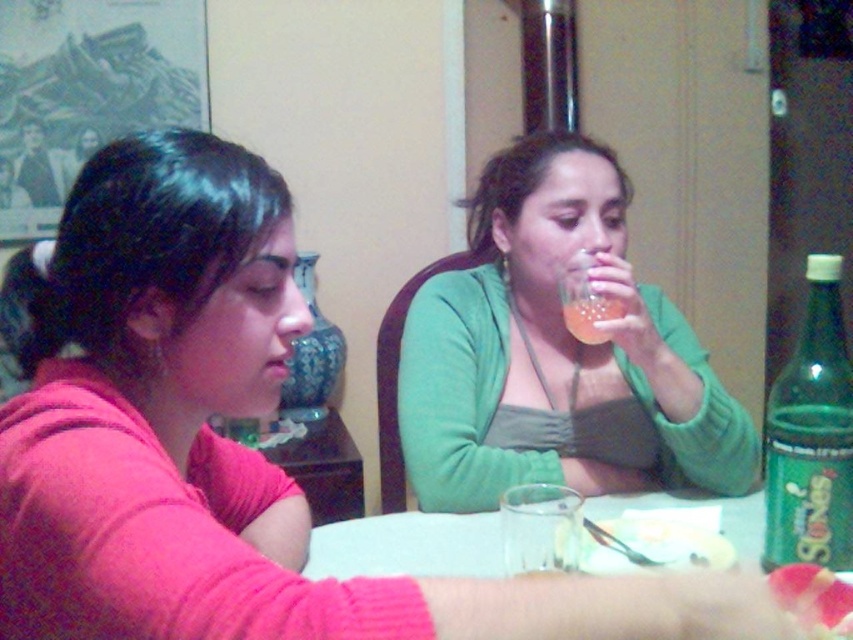
Question: Among these objects, which one is farthest from the camera?

Choices:
 (A) translucent plastic cup at upper center
 (B) green glass bottle at right

Answer: (A)

Question: Among these objects, which one is farthest from the camera?

Choices:
 (A) green glass bottle at right
 (B) pink glossy flower at upper center
 (C) white plastic table at lower center
 (D) green textured sweater at upper right

Answer: (D)

Question: Which is farther from the pink glossy flower at upper center?

Choices:
 (A) white plastic table at lower center
 (B) green glass bottle at right

Answer: (A)

Question: Can you confirm if green textured sweater at upper right is thinner than green glass bottle at right?

Choices:
 (A) no
 (B) yes

Answer: (A)

Question: In this image, where is white plastic table at lower center located relative to translucent plastic cup at upper center?

Choices:
 (A) below
 (B) above

Answer: (A)

Question: Is white plastic table at lower center below translucent plastic cup at upper center?

Choices:
 (A) yes
 (B) no

Answer: (A)